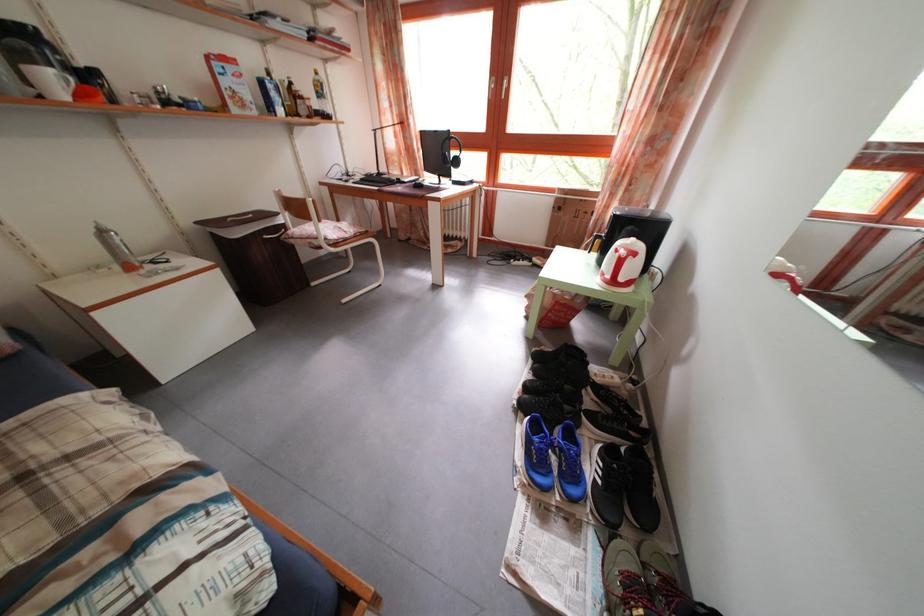
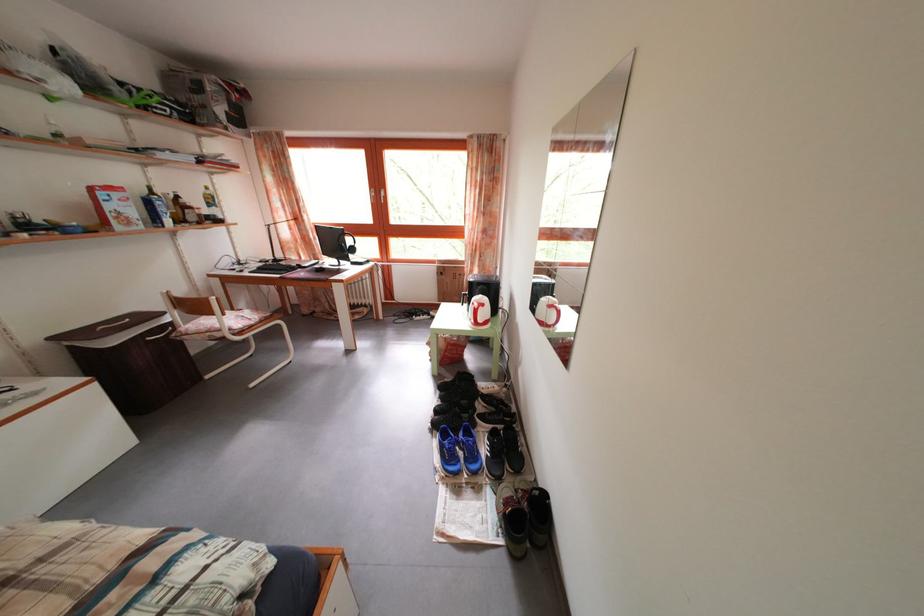
Question: Which direction would the cameraman need to move to produce the second image? Reply with the corresponding letter.

Choices:
 (A) Left
 (B) Right
 (C) Forward
 (D) Backward

Answer: (D)